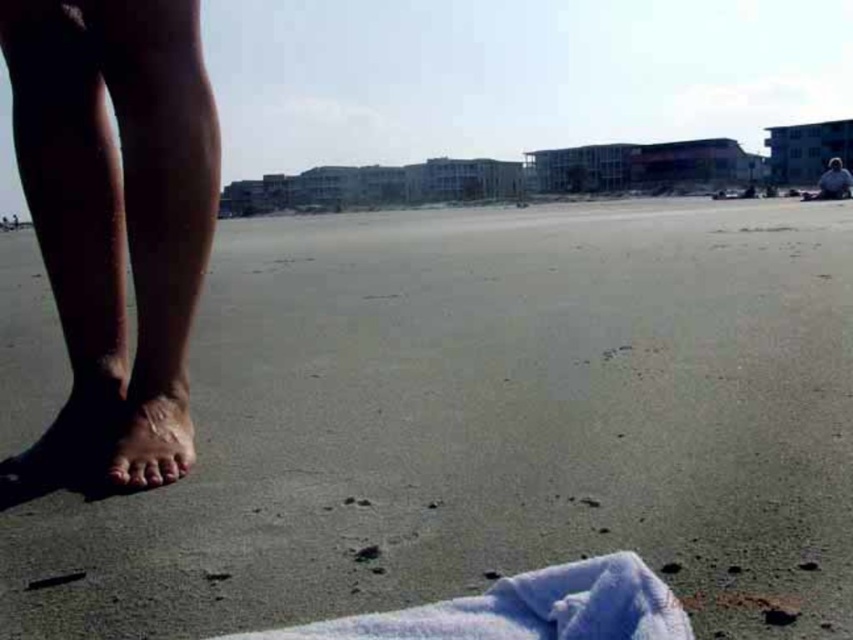
Question: Is dry skin at lower left smaller than dry skin foot at lower left?

Choices:
 (A) yes
 (B) no

Answer: (B)

Question: Which of the following is the closest to the observer?

Choices:
 (A) dry skin at lower left
 (B) dry skin foot at lower left
 (C) smooth skin foot at lower left
 (D) dark blue fabric at upper right

Answer: (A)

Question: Which object is closer to the camera taking this photo?

Choices:
 (A) dry skin at lower left
 (B) smooth skin foot at lower left

Answer: (A)

Question: Which point is farther to the camera?

Choices:
 (A) sandy beach at lower left
 (B) dry skin at lower left
 (C) dark blue fabric at upper right
 (D) dry skin foot at lower left

Answer: (C)

Question: From the image, what is the correct spatial relationship of dry skin at lower left in relation to soft blue towel at lower center?

Choices:
 (A) left
 (B) right

Answer: (A)

Question: Can you confirm if dry skin at lower left is thinner than dry skin foot at lower left?

Choices:
 (A) yes
 (B) no

Answer: (B)